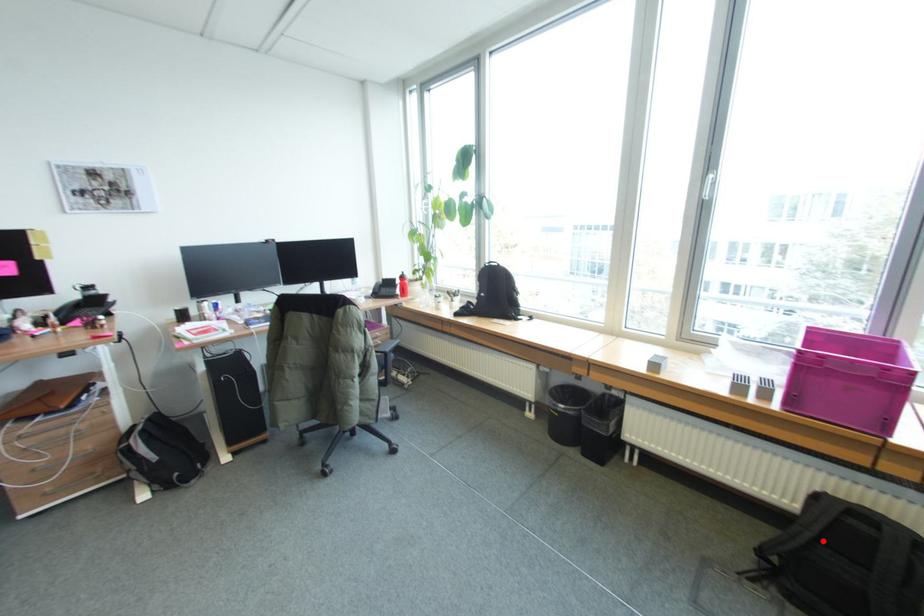
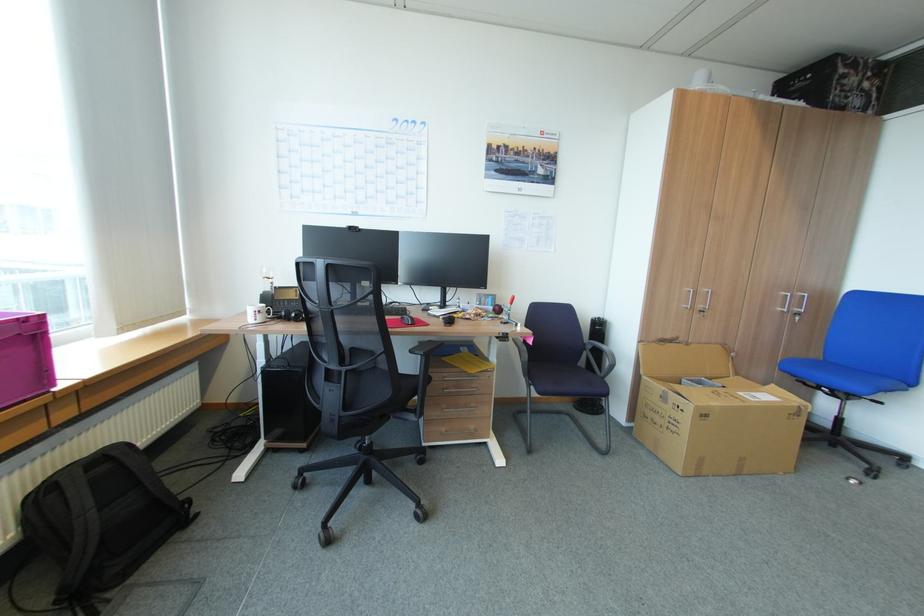
The point at the highlighted location is marked in the first image. Where is the corresponding point in the second image?

(103, 511)